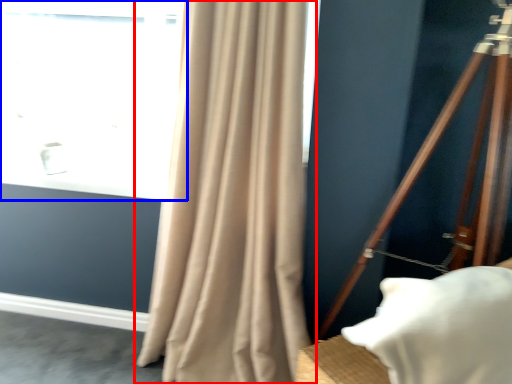
Question: Among these objects, which one is farthest to the camera, curtain (highlighted by a red box) or window (highlighted by a blue box)?

Choices:
 (A) curtain
 (B) window

Answer: (B)